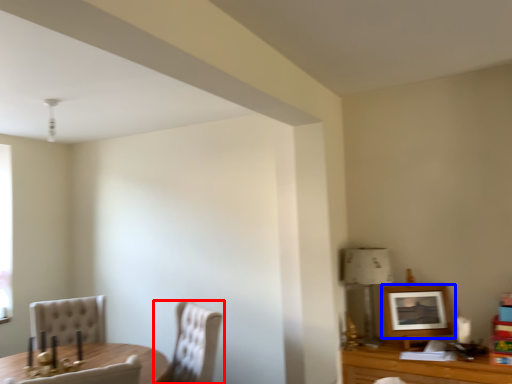
Question: Which point is further to the camera, chair (highlighted by a red box) or picture frame (highlighted by a blue box)?

Choices:
 (A) chair
 (B) picture frame

Answer: (B)